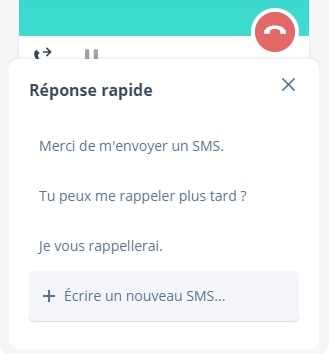
Find the location of a particular element. phone button is located at coordinates (271, 30).